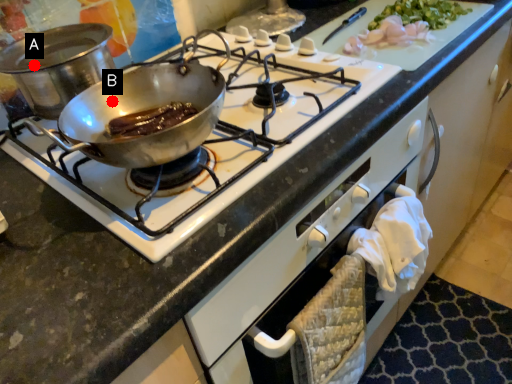
Question: Two points are circled on the image, labeled by A and B beside each circle. Which point appears closest to the camera in this image?

Choices:
 (A) A is closer
 (B) B is closer

Answer: (A)